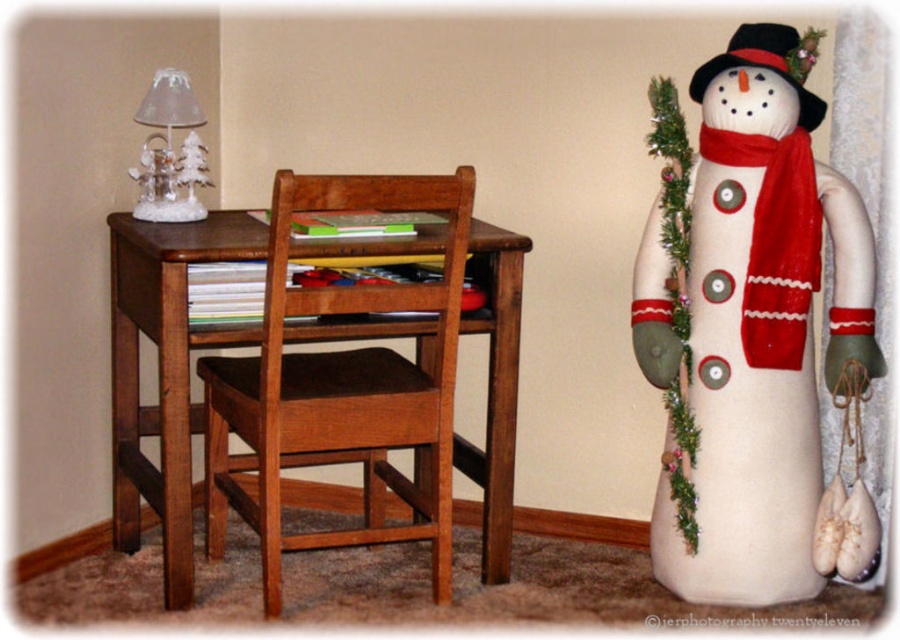
You are a parent trying to place a new toy on the desk. The toy requires a space of 22 inches between the wooden chair at center and the clear glass lampshade at upper left. Is there enough space?

The wooden chair at center is 21.96 inches from clear glass lampshade at upper left, so there is not enough space for the toy which requires 22 inches.

You are trying to place a new decorative item on the desk. The item is 15 cm wide. Can the felt snowman at right and the clear glass lampshade at upper left both fit on the desk without overlapping if the item is placed between them?

The felt snowman at right might be wider than clear glass lampshade at upper left, so there might not be enough space between them to fit the 15 cm wide item without overlapping.

You are a delivery robot with a height of 1.8 meters. You are approaching the felt snowman at right. Will you hit your head on the ceiling before reaching it?

The felt snowman at right is 1.98 meters away from the camera. Since the robot is 1.8 meters tall, it will not hit its head on the ceiling before reaching the felt snowman at right.